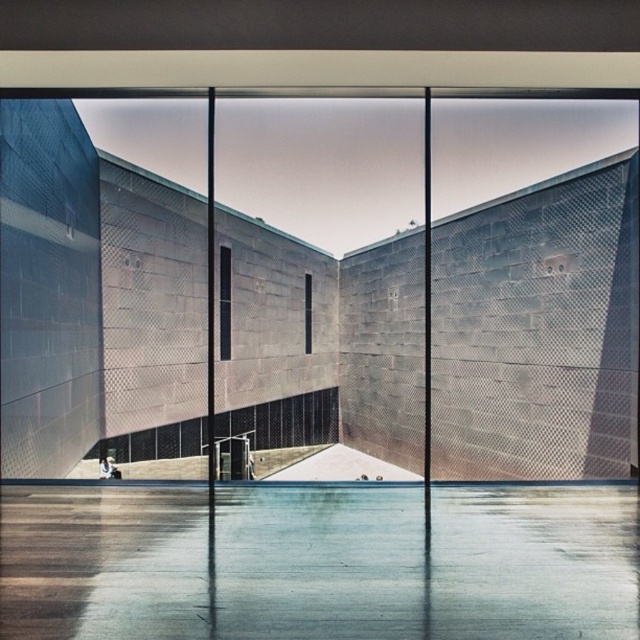
Is transparent glass door at center shorter than white matte skateboard at lower center?

No, transparent glass door at center is not shorter than white matte skateboard at lower center.

Is transparent glass door at center smaller than white matte skateboard at lower center?

Incorrect, transparent glass door at center is not smaller in size than white matte skateboard at lower center.

The width and height of the screenshot is (640, 640). Describe the element at coordinates (532, 289) in the screenshot. I see `transparent glass door at center` at that location.

Find the location of a particular element. transparent glass door at center is located at coordinates (532, 289).